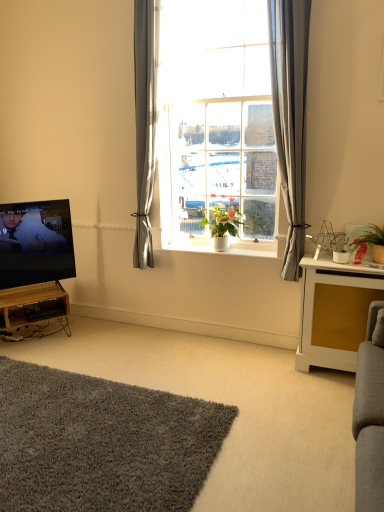
Question: In terms of size, does matte black tv at left appear bigger or smaller than gray fabric curtain at center?

Choices:
 (A) small
 (B) big

Answer: (A)

Question: Looking at their shapes, would you say matte black tv at left is wider or thinner than gray fabric curtain at center?

Choices:
 (A) wide
 (B) thin

Answer: (A)

Question: Based on their relative distances, which object is nearer to the gray fabric curtain at center?

Choices:
 (A) wooden at left, positioned as the first table in back-to-front order
 (B) white textured cabinet at right, positioned as the 1th table in front-to-back order
 (C) clear glass window at center
 (D) soft gray carpet at lower left
 (E) green matte plant at center, which is the 1th houseplant in left-to-right order

Answer: (B)

Question: Based on their relative distances, which object is farther from the green matte plant at right, which appears as the first houseplant when viewed from the front?

Choices:
 (A) green matte plant at center, which is the 1th houseplant in left-to-right order
 (B) white textured cabinet at right, arranged as the second table when viewed from the left
 (C) gray fabric curtain at center
 (D) soft gray carpet at lower left
 (E) wooden at left, which is counted as the 2th table, starting from the front

Answer: (E)